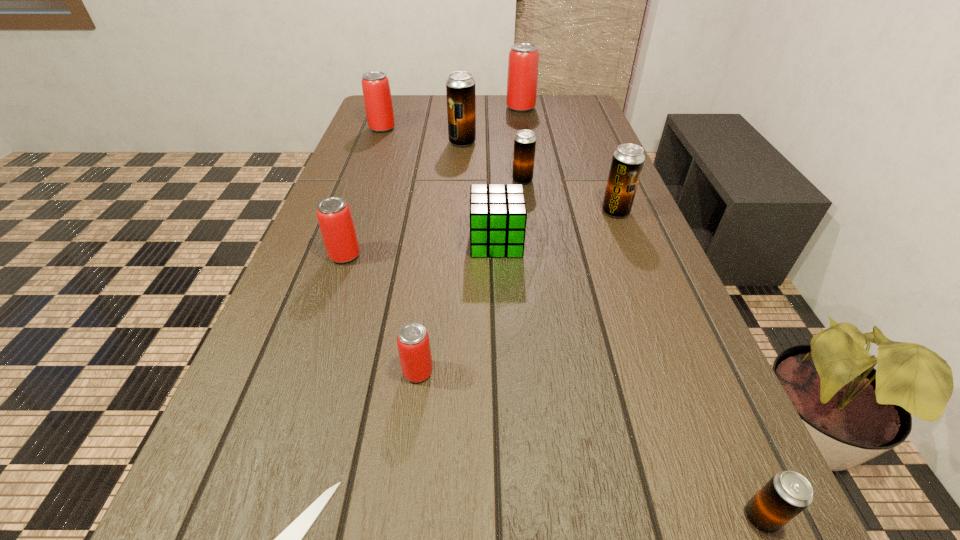
Point out which pink beer can is positioned as the nearest to the third nearest beer can. Please provide its 2D coordinates. Your answer should be formatted as a tuple, i.e. [(x, y)], where the tuple contains the x and y coordinates of a point satisfying the conditions above.

[(413, 343)]

Locate an element on the screen. black beer can that is the second closest to the second farthest object is located at coordinates (525, 141).

You are a GUI agent. You are given a task and a screenshot of the screen. Output one action in this format:
    pyautogui.click(x=<x>, y=<y>)
    Task: Click on the black beer can that is the third nearest to the third farthest black beer can
    This screenshot has height=540, width=960.
    Given the screenshot: What is the action you would take?
    pyautogui.click(x=787, y=493)

This screenshot has height=540, width=960. I want to click on free location that satisfies the following two spatial constraints: 1. on the front side of the third nearest pink beer can; 2. on the right side of the fifth farthest object, so click(x=351, y=212).

The height and width of the screenshot is (540, 960). Find the location of `vacant region that satisfies the following two spatial constraints: 1. on the front side of the nearest black beer can; 2. on the left side of the farthest beer can`. vacant region that satisfies the following two spatial constraints: 1. on the front side of the nearest black beer can; 2. on the left side of the farthest beer can is located at coordinates (589, 517).